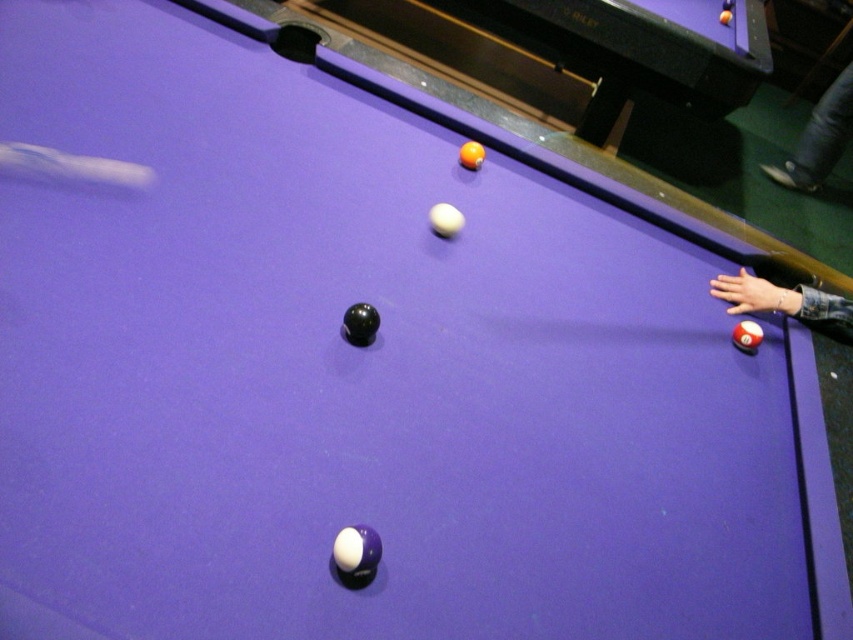
You are a pool player trying to determine if the orange glossy ball at upper center can fit into a pocket that is the same size as the denim pants at right. Based on their sizes, will it fit?

The orange glossy ball at upper center is larger in width than the denim pants at right, so it will not fit into a pocket of the same size as the denim pants at right.

Looking at this image, you are standing at the center of the pool table and want to place a new ball exactly at point [819,138]. What is currently at that location?

Denim pants at right is at point [819,138].